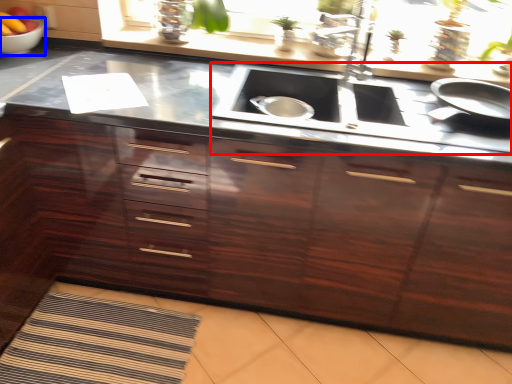
Question: Which object is further to the camera taking this photo, stove (highlighted by a red box) or mixing bowl (highlighted by a blue box)?

Choices:
 (A) stove
 (B) mixing bowl

Answer: (B)